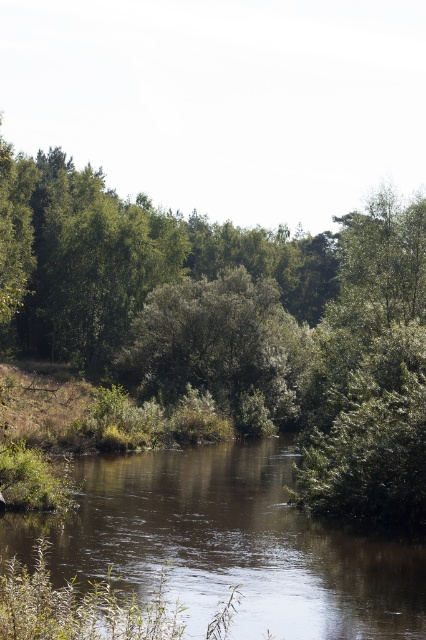
Does brown smooth water at center have a greater height compared to green leafy tree at center?

No.

Who is shorter, brown smooth water at center or green leafy tree at center?

brown smooth water at center is shorter.

Does point (279, 502) come farther from viewer compared to point (155, 337)?

No, it is not.

Image resolution: width=426 pixels, height=640 pixels. In order to click on brown smooth water at center in this screenshot , I will do `click(230, 545)`.

Does green leafy forest at center appear over green leafy tree at center?

Yes.

Does point (178, 356) come behind point (152, 317)?

Yes, it is.

Identify the location of green leafy forest at center. (233, 320).

You are a GUI agent. You are given a task and a screenshot of the screen. Output one action in this format:
    pyautogui.click(x=<x>, y=<y>)
    Task: Click on the green leafy forest at center
    
    Given the screenshot: What is the action you would take?
    pyautogui.click(x=233, y=320)

Where is `green leafy forest at center`? Image resolution: width=426 pixels, height=640 pixels. green leafy forest at center is located at coordinates (233, 320).

Is green leafy forest at center thinner than brown smooth water at center?

In fact, green leafy forest at center might be wider than brown smooth water at center.

Who is more forward, (135, 211) or (189, 468)?

Point (189, 468) is in front.

In order to click on green leafy forest at center in this screenshot , I will do `click(233, 320)`.